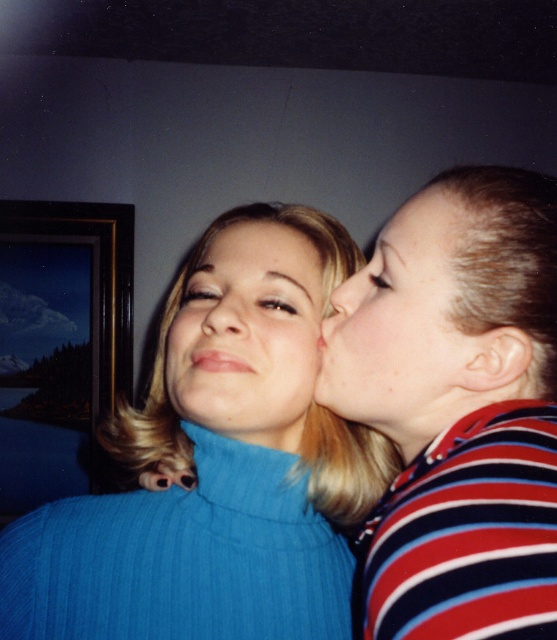
Question: Does wooden picture frame at upper left appear on the left side of smooth blonde hair at upper center?

Choices:
 (A) yes
 (B) no

Answer: (A)

Question: Which point is farther to the camera?

Choices:
 (A) (80, 227)
 (B) (204, 296)
 (C) (227, 243)

Answer: (A)

Question: Which object appears closest to the camera in this image?

Choices:
 (A) smooth blonde hair at upper center
 (B) matte blue sweater at center
 (C) matte skin face at upper right

Answer: (C)

Question: Does wooden picture frame at upper left appear over smooth blonde hair at upper center?

Choices:
 (A) no
 (B) yes

Answer: (A)

Question: Which of the following is the farthest from the observer?

Choices:
 (A) (255, 364)
 (B) (217, 314)
 (C) (302, 483)
 (D) (13, 490)

Answer: (D)

Question: Is wooden picture frame at upper left to the right of matte blue sweater at center from the viewer's perspective?

Choices:
 (A) no
 (B) yes

Answer: (A)